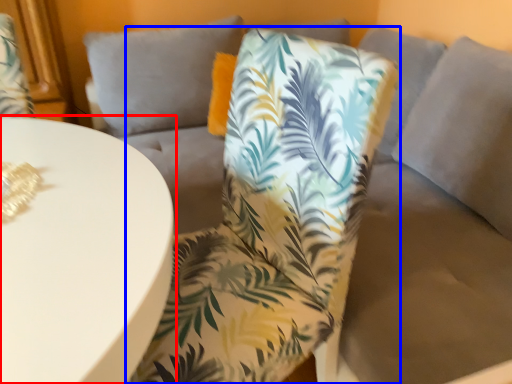
Question: Which of the following is the farthest to the observer, table (highlighted by a red box) or chair (highlighted by a blue box)?

Choices:
 (A) table
 (B) chair

Answer: (B)